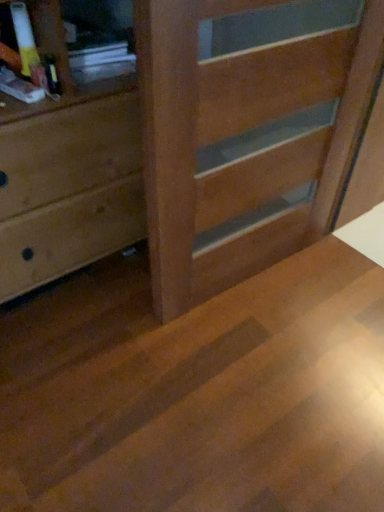
Where is `matte wood chest of drawers at center`? This screenshot has width=384, height=512. matte wood chest of drawers at center is located at coordinates (201, 147).

What do you see at coordinates (201, 147) in the screenshot?
I see `matte wood chest of drawers at center` at bounding box center [201, 147].

This screenshot has width=384, height=512. What are the coordinates of `matte wood chest of drawers at center` in the screenshot? It's located at (201, 147).